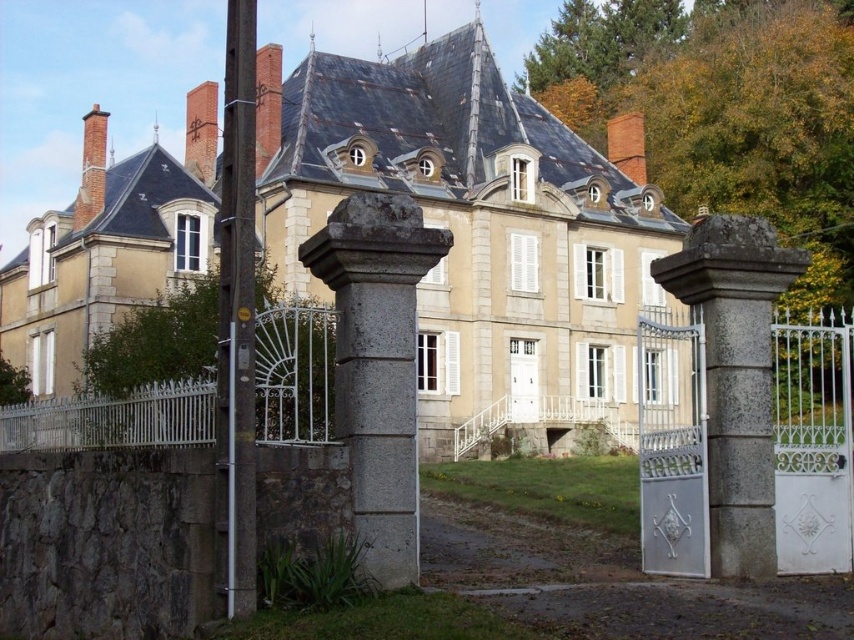
Locate an element on the screen. The image size is (854, 640). beige stone mansion at center is located at coordinates (477, 228).

This screenshot has width=854, height=640. What are the coordinates of `beige stone mansion at center` in the screenshot? It's located at (477, 228).

The width and height of the screenshot is (854, 640). What are the coordinates of `beige stone mansion at center` in the screenshot? It's located at (477, 228).

Between gray stone pillar at center and brown wooden pole at left, which one has less height?

gray stone pillar at center

Find the location of a particular element. The width and height of the screenshot is (854, 640). gray stone pillar at center is located at coordinates (377, 365).

Does gray stone pillar at center lie in front of gray stone gate at center?

Yes, it is.

Who is more forward, (355, 456) or (730, 512)?

Point (355, 456)

You are a GUI agent. You are given a task and a screenshot of the screen. Output one action in this format:
    pyautogui.click(x=<x>, y=<y>)
    Task: Click on the gray stone pillar at center
    The image size is (854, 640).
    Given the screenshot: What is the action you would take?
    pyautogui.click(x=377, y=365)

Locate an element on the screen. The image size is (854, 640). gray stone pillar at center is located at coordinates (377, 365).